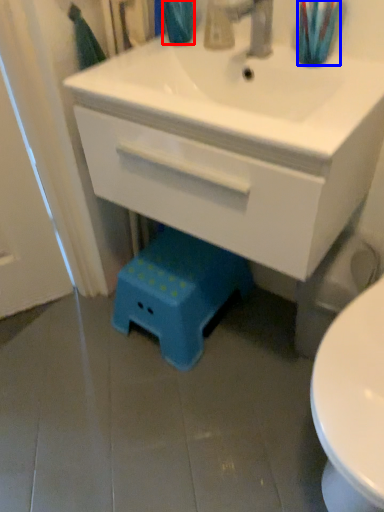
Question: Which object is closer to the camera taking this photo, teal (highlighted by a red box) or toothbrush (highlighted by a blue box)?

Choices:
 (A) teal
 (B) toothbrush

Answer: (B)